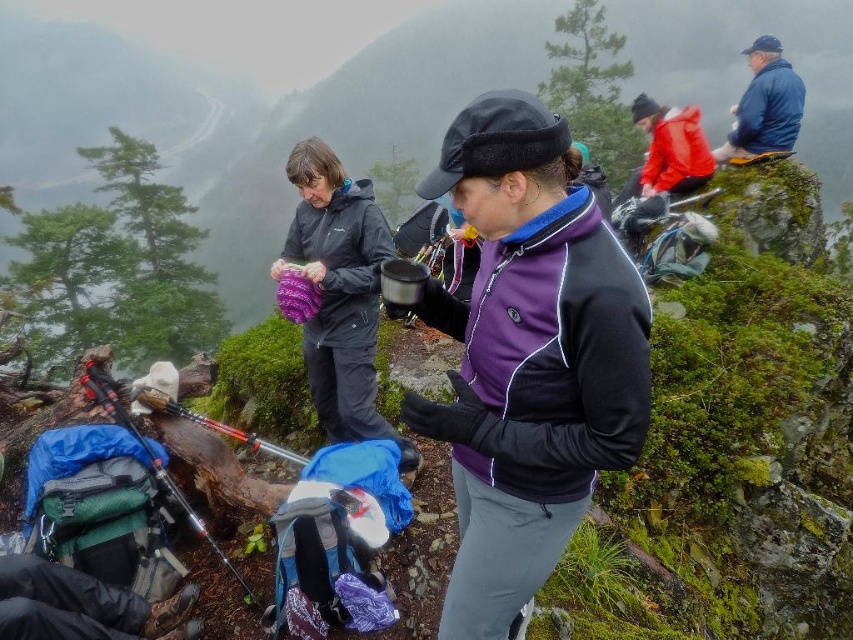
Question: Does blue fleece jacket at upper right appear under red matte jacket at upper right?

Choices:
 (A) no
 (B) yes

Answer: (B)

Question: Is purple fleece jacket at center smaller than matte purple bag at center?

Choices:
 (A) yes
 (B) no

Answer: (A)

Question: Which object is farther from the camera taking this photo?

Choices:
 (A) matte purple bag at center
 (B) blue fleece jacket at upper right
 (C) green leafy tree at upper left

Answer: (C)

Question: Which point is closer to the camera?

Choices:
 (A) [740, 120]
 (B) [692, 156]
 (C) [544, 480]

Answer: (C)

Question: Which object appears farthest from the camera in this image?

Choices:
 (A) blue fleece jacket at upper right
 (B) purple fleece jacket at center
 (C) green leafy tree at upper left

Answer: (C)

Question: Observing the image, what is the correct spatial positioning of matte purple bag at center in reference to red matte jacket at upper right?

Choices:
 (A) below
 (B) above

Answer: (A)